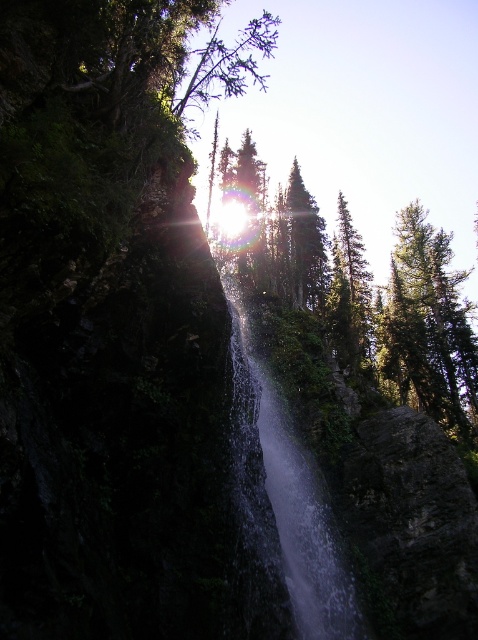
Question: Does clear water at center lie in front of green textured tree at upper center?

Choices:
 (A) no
 (B) yes

Answer: (B)

Question: Which point is closer to the camera?

Choices:
 (A) green matte tree at upper center
 (B) clear water at center

Answer: (B)

Question: Which point is closer to the camera?

Choices:
 (A) clear water at center
 (B) green textured tree at upper center
 (C) green matte tree at upper center

Answer: (A)

Question: Observing the image, what is the correct spatial positioning of green textured tree at center in reference to clear water at center?

Choices:
 (A) below
 (B) above

Answer: (B)

Question: Is green matte tree at upper center to the right of green textured tree at upper center from the viewer's perspective?

Choices:
 (A) no
 (B) yes

Answer: (B)

Question: Which object appears closest to the camera in this image?

Choices:
 (A) green matte tree at upper center
 (B) green textured tree at center
 (C) clear water at center
 (D) green textured tree at upper center

Answer: (C)